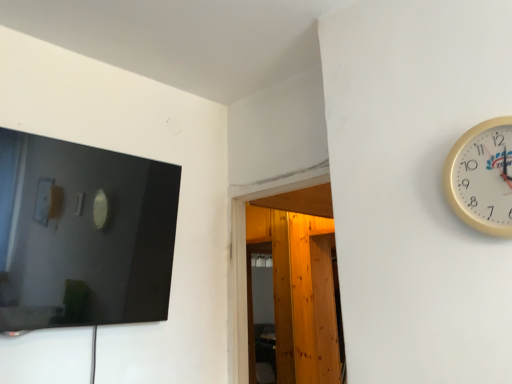
Question: Is transparent wooden door at center completely or partially inside white plastic wall clock at right?

Choices:
 (A) no
 (B) yes

Answer: (A)

Question: Is white plastic wall clock at right not near transparent wooden door at center?

Choices:
 (A) yes
 (B) no

Answer: (A)

Question: Does white plastic wall clock at right have a smaller size compared to transparent wooden door at center?

Choices:
 (A) yes
 (B) no

Answer: (A)

Question: Can you confirm if white plastic wall clock at right is positioned to the right of transparent wooden door at center?

Choices:
 (A) yes
 (B) no

Answer: (A)

Question: Is white plastic wall clock at right directly adjacent to transparent wooden door at center?

Choices:
 (A) no
 (B) yes

Answer: (A)

Question: Can you confirm if white plastic wall clock at right is thinner than transparent wooden door at center?

Choices:
 (A) no
 (B) yes

Answer: (B)

Question: Is transparent wooden door at center not near white plastic wall clock at right?

Choices:
 (A) no
 (B) yes

Answer: (B)

Question: Considering the relative sizes of transparent wooden door at center and white plastic wall clock at right in the image provided, is transparent wooden door at center smaller than white plastic wall clock at right?

Choices:
 (A) yes
 (B) no

Answer: (B)

Question: Is transparent wooden door at center turned away from white plastic wall clock at right?

Choices:
 (A) no
 (B) yes

Answer: (A)

Question: Is the position of transparent wooden door at center less distant than that of white plastic wall clock at right?

Choices:
 (A) no
 (B) yes

Answer: (A)

Question: Is transparent wooden door at center to the right of white plastic wall clock at right from the viewer's perspective?

Choices:
 (A) yes
 (B) no

Answer: (B)

Question: Is transparent wooden door at center bigger than white plastic wall clock at right?

Choices:
 (A) yes
 (B) no

Answer: (A)

Question: Based on their positions, is transparent wooden door at center located to the left or right of white plastic wall clock at right?

Choices:
 (A) right
 (B) left

Answer: (B)